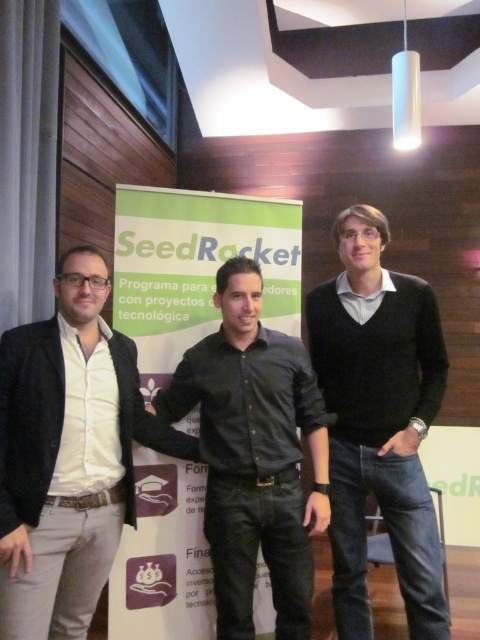
Locate an element on the screen. The height and width of the screenshot is (640, 480). black sweater at center is located at coordinates (379, 420).

Does black sweater at center appear on the left side of black leather shirt at center?

No, black sweater at center is not to the left of black leather shirt at center.

What are the coordinates of `black sweater at center` in the screenshot? It's located at (379, 420).

You are a GUI agent. You are given a task and a screenshot of the screen. Output one action in this format:
    pyautogui.click(x=<x>, y=<y>)
    Task: Click on the black sweater at center
    
    Given the screenshot: What is the action you would take?
    pyautogui.click(x=379, y=420)

Based on the photo, between white matte shirt at left and black leather shirt at center, which one has more height?

Standing taller between the two is white matte shirt at left.

From the picture: Is white matte shirt at left positioned at the back of black leather shirt at center?

No, white matte shirt at left is closer to the viewer.

Who is more forward, (131, 512) or (164, 413)?

Point (131, 512) is in front.

You are a GUI agent. You are given a task and a screenshot of the screen. Output one action in this format:
    pyautogui.click(x=<x>, y=<y>)
    Task: Click on the white matte shirt at left
    The image size is (480, 640).
    Given the screenshot: What is the action you would take?
    pyautogui.click(x=69, y=456)

Does white matte shirt at left have a greater height compared to black sweater at center?

No.

Locate an element on the screen. The image size is (480, 640). white matte shirt at left is located at coordinates (69, 456).